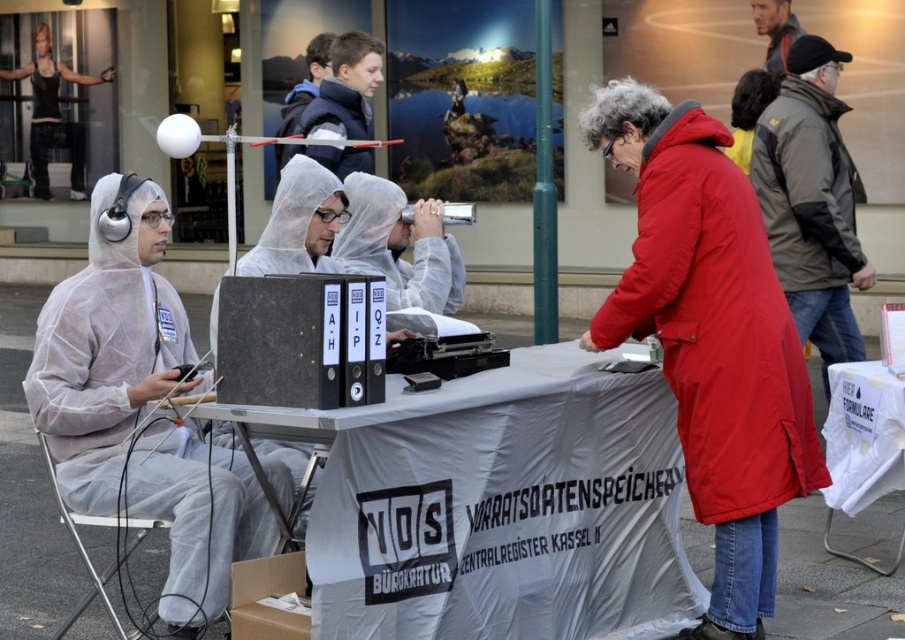
Question: Can you confirm if black tank top at upper left is positioned below blonde hair at upper center?

Choices:
 (A) yes
 (B) no

Answer: (B)

Question: Is the position of black plastic box at center less distant than that of white paper at lower right?

Choices:
 (A) no
 (B) yes

Answer: (B)

Question: Which point is closer to the camera taking this photo?

Choices:
 (A) (141, 362)
 (B) (780, 10)

Answer: (A)

Question: Which object appears farthest from the camera in this image?

Choices:
 (A) white paper at lower right
 (B) white plastic table at center
 (C) blue fleece jacket at upper center

Answer: (C)

Question: Considering the relative positions of dark gray jacket at right and black plastic box at center in the image provided, where is dark gray jacket at right located with respect to black plastic box at center?

Choices:
 (A) left
 (B) right

Answer: (B)

Question: Which object is the farthest from the cardboard box at lower center?

Choices:
 (A) red matte coat at center
 (B) black tank top at upper left

Answer: (B)